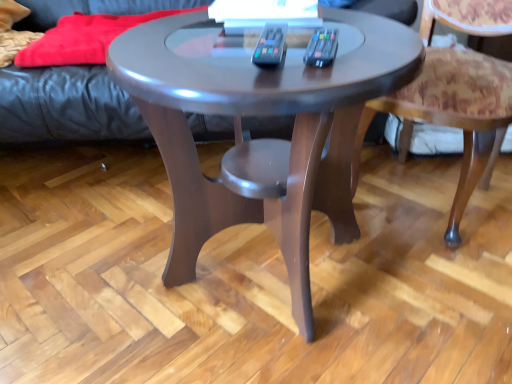
Where is `vacant space underneath patterned fabric chair at lower right (from a real-world perspective)`? vacant space underneath patterned fabric chair at lower right (from a real-world perspective) is located at coordinates (413, 195).